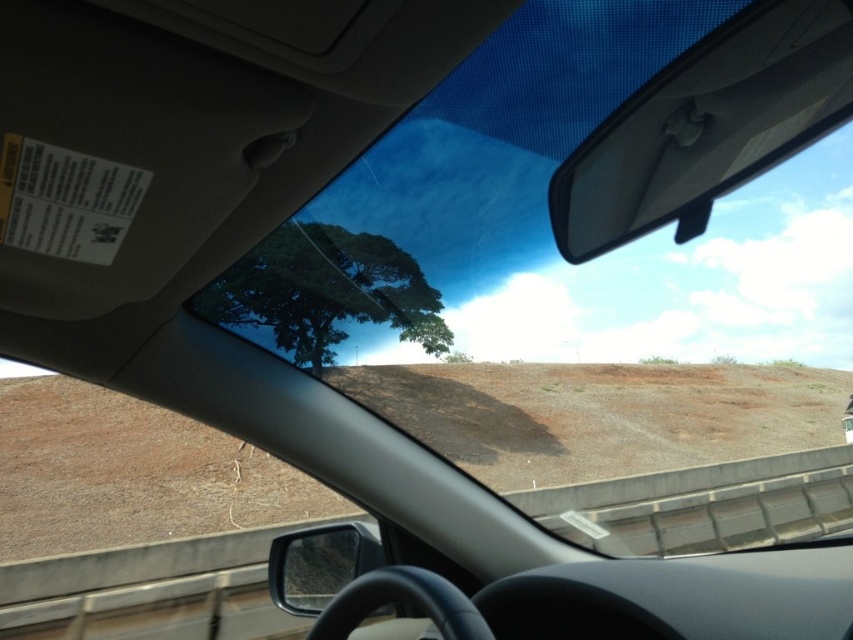
Question: Which object is positioned farthest from the white plastic view mirror at upper center?

Choices:
 (A) black plastic side mirror at lower center
 (B) green leafy tree at center

Answer: (B)

Question: Which of the following is the closest to the observer?

Choices:
 (A) black plastic side mirror at lower center
 (B) white plastic view mirror at upper center

Answer: (B)

Question: Where is white plastic view mirror at upper center located in relation to black plastic side mirror at lower center in the image?

Choices:
 (A) right
 (B) left

Answer: (A)

Question: Does white plastic view mirror at upper center have a greater width compared to green leafy tree at center?

Choices:
 (A) no
 (B) yes

Answer: (A)

Question: Is green leafy tree at center bigger than black plastic side mirror at lower center?

Choices:
 (A) no
 (B) yes

Answer: (B)

Question: Which point is farther to the camera?

Choices:
 (A) (297, 234)
 (B) (799, 38)
 (C) (305, 561)

Answer: (A)